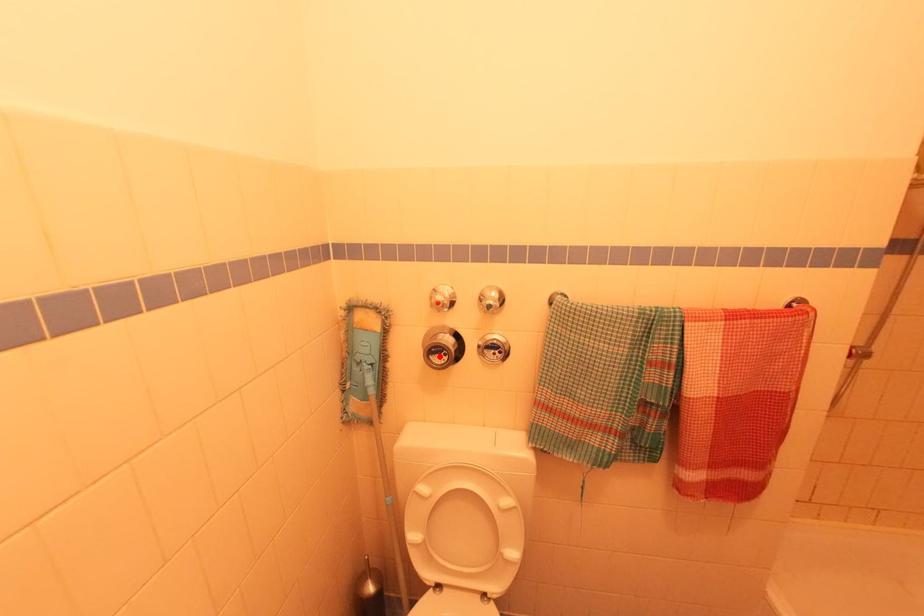
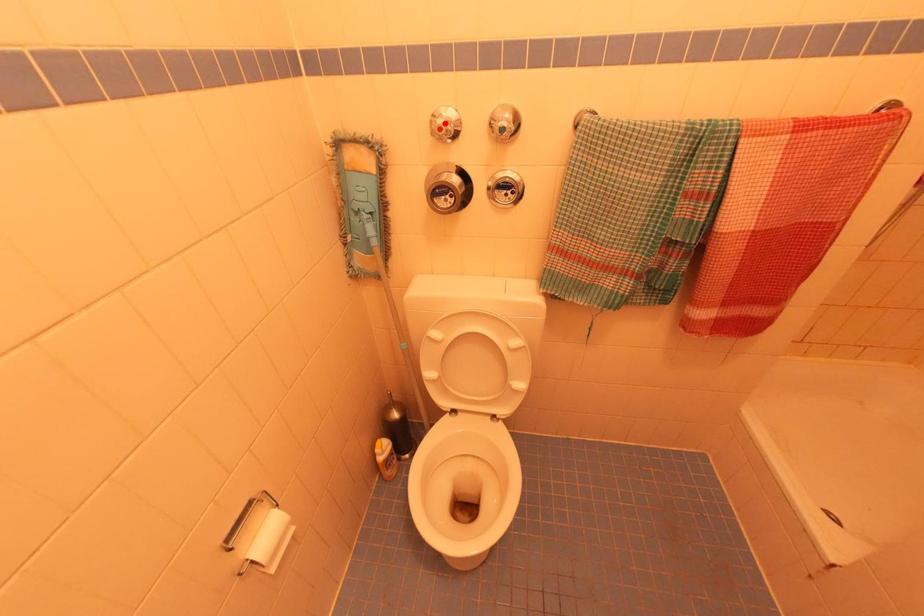
I am providing you with two images of the same scene from different viewpoints. A red point is marked on the first image and another point is marked on the second image. Are the points marked in image1 and image2 representing the same 3D position?

No